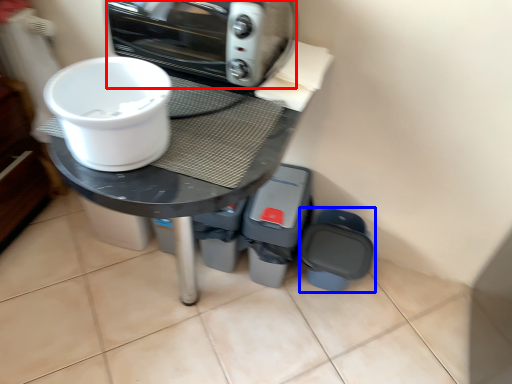
Question: Which object appears closest to the camera in this image, kitchen appliance (highlighted by a red box) or appliance (highlighted by a blue box)?

Choices:
 (A) kitchen appliance
 (B) appliance

Answer: (A)